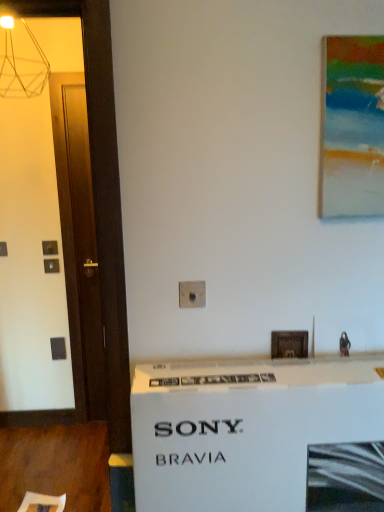
Question: Is wooden picture frame at center, which is the first picture frame in bottom-to-top order, wider than white cardboard box at center?

Choices:
 (A) yes
 (B) no

Answer: (B)

Question: Is wooden picture frame at center, which is the first picture frame in bottom-to-top order, turned away from white cardboard box at center?

Choices:
 (A) yes
 (B) no

Answer: (B)

Question: Is wooden picture frame at center, the second picture frame viewed from the right, with white cardboard box at center?

Choices:
 (A) yes
 (B) no

Answer: (B)

Question: Is wooden picture frame at center, placed as the first picture frame when sorted from left to right, positioned behind white cardboard box at center?

Choices:
 (A) no
 (B) yes

Answer: (B)

Question: Is wooden picture frame at center, the second picture frame from the front, bigger than white cardboard box at center?

Choices:
 (A) yes
 (B) no

Answer: (B)

Question: From a real-world perspective, is wooden picture frame at center, the second picture frame viewed from the right, located higher than white cardboard box at center?

Choices:
 (A) yes
 (B) no

Answer: (A)

Question: Considering the relative sizes of acrylic painting at upper right, which appears as the 2th picture frame when viewed from the back, and white cardboard box at center in the image provided, is acrylic painting at upper right, which appears as the 2th picture frame when viewed from the back, thinner than white cardboard box at center?

Choices:
 (A) yes
 (B) no

Answer: (A)

Question: Is acrylic painting at upper right, which appears as the 2th picture frame when viewed from the back, at the left side of white cardboard box at center?

Choices:
 (A) no
 (B) yes

Answer: (A)

Question: Is acrylic painting at upper right, positioned as the first picture frame in front-to-back order, positioned in front of white cardboard box at center?

Choices:
 (A) no
 (B) yes

Answer: (A)

Question: Is acrylic painting at upper right, marked as the second picture frame in a bottom-to-top arrangement, not within white cardboard box at center?

Choices:
 (A) yes
 (B) no

Answer: (A)

Question: From the image's perspective, is acrylic painting at upper right, which appears as the 2th picture frame when viewed from the back, located beneath white cardboard box at center?

Choices:
 (A) no
 (B) yes

Answer: (A)

Question: From the image's perspective, is acrylic painting at upper right, the 1th picture frame positioned from the right, located above white cardboard box at center?

Choices:
 (A) no
 (B) yes

Answer: (B)

Question: Is wooden picture frame at center, the second picture frame from the front, outside of acrylic painting at upper right, the 1th picture frame positioned from the right?

Choices:
 (A) yes
 (B) no

Answer: (A)